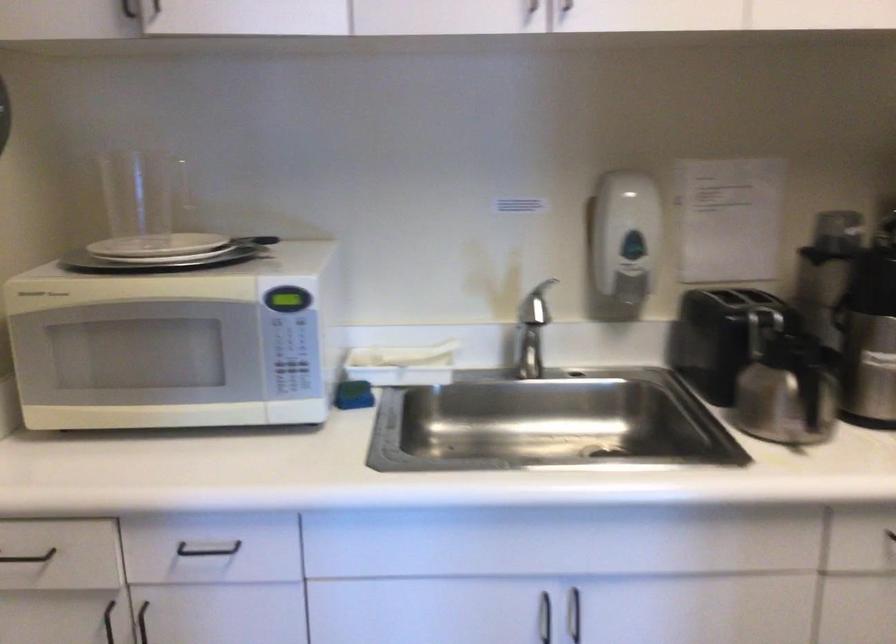
What do you see at coordinates (631, 288) in the screenshot?
I see `the soap dispenser lever` at bounding box center [631, 288].